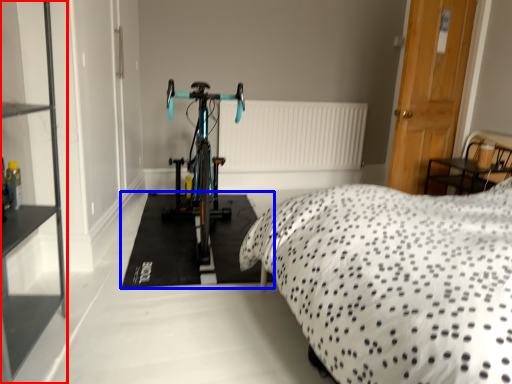
Question: Which object appears farthest to the camera in this image, shelf (highlighted by a red box) or flat (highlighted by a blue box)?

Choices:
 (A) shelf
 (B) flat

Answer: (B)